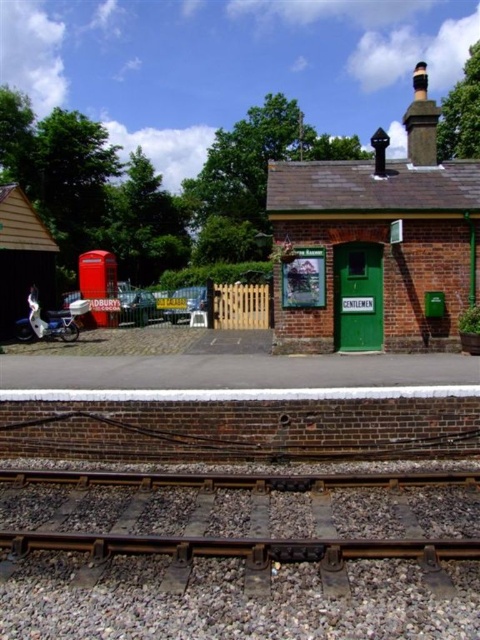
Question: Does dark brown metal train track at bottom have a greater width compared to green painted brick building at upper right?

Choices:
 (A) no
 (B) yes

Answer: (A)

Question: Does dark brown metal train track at bottom lie in front of green painted brick building at upper right?

Choices:
 (A) no
 (B) yes

Answer: (B)

Question: Among these objects, which one is farthest from the camera?

Choices:
 (A) green painted brick building at upper right
 (B) dark brown metal train track at bottom

Answer: (A)

Question: Which point is farther to the camera?

Choices:
 (A) green painted brick building at upper right
 (B) dark brown metal train track at bottom

Answer: (A)

Question: Which of the following is the closest to the observer?

Choices:
 (A) dark brown metal train track at bottom
 (B) green painted brick building at upper right

Answer: (A)

Question: Does dark brown metal train track at bottom have a lesser width compared to green painted brick building at upper right?

Choices:
 (A) yes
 (B) no

Answer: (A)